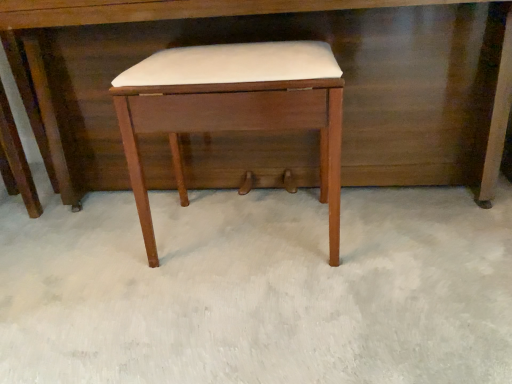
Identify the location of empty space that is to the right of white leather stool at center. (397, 242).